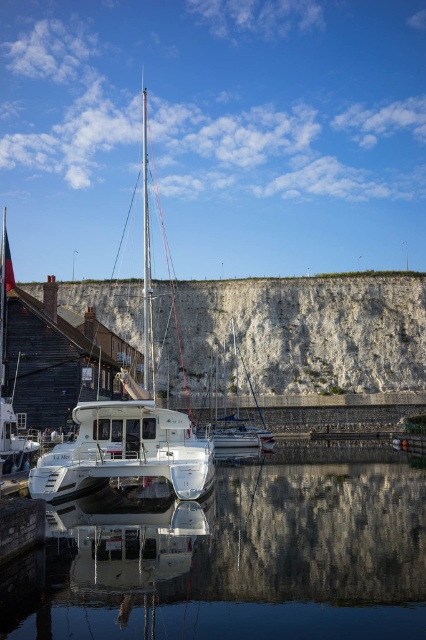
Does white glossy catamaran at center appear over white glossy mast at center?

No, white glossy catamaran at center is not above white glossy mast at center.

Based on the photo, does white glossy catamaran at center have a lesser height compared to white glossy mast at center?

Indeed, white glossy catamaran at center has a lesser height compared to white glossy mast at center.

Where is `white glossy catamaran at center`? The image size is (426, 640). white glossy catamaran at center is located at coordinates tap(124, 451).

Which is above, white stone cliff at center or white glossy catamaran at center?

white stone cliff at center is above.

Locate an element on the screen. white stone cliff at center is located at coordinates (305, 332).

Is point (350, 346) farther from viewer compared to point (207, 458)?

That is True.

The width and height of the screenshot is (426, 640). I want to click on white stone cliff at center, so click(x=305, y=332).

Is transparent glass water at center in front of white glossy catamaran at center?

Yes, it is.

Find the location of a particular element. This screenshot has height=640, width=426. transparent glass water at center is located at coordinates (236, 556).